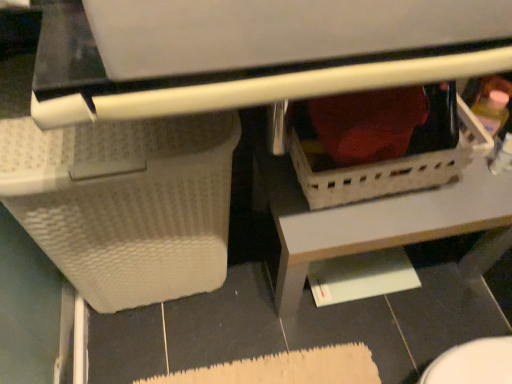
The height and width of the screenshot is (384, 512). Identify the location of free space in front of white textured basket at lower left, which appears as the second basket when viewed from the right. (159, 355).